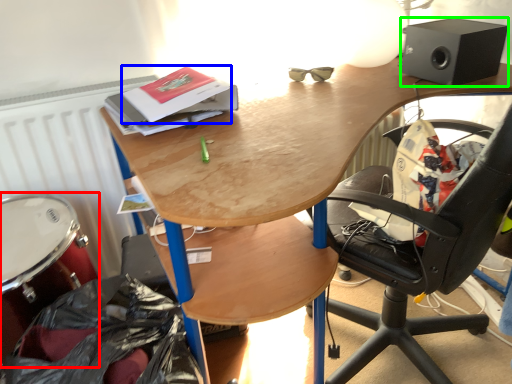
Question: Which object is the farthest from drum (highlighted by a red box)? Choose among these: paperback book (highlighted by a blue box) or loudspeaker (highlighted by a green box).

Choices:
 (A) paperback book
 (B) loudspeaker

Answer: (B)